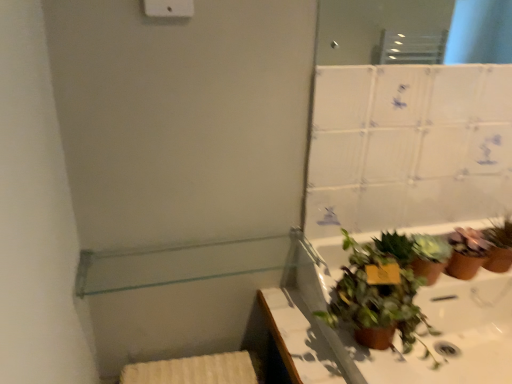
Question: Does clear glass shelf at upper left touch white plastic light switch at upper center?

Choices:
 (A) no
 (B) yes

Answer: (A)

Question: From the image's perspective, would you say clear glass shelf at upper left is shown under white plastic light switch at upper center?

Choices:
 (A) no
 (B) yes

Answer: (B)

Question: Does clear glass shelf at upper left have a greater height compared to white plastic light switch at upper center?

Choices:
 (A) no
 (B) yes

Answer: (A)

Question: Is clear glass shelf at upper left positioned in front of white plastic light switch at upper center?

Choices:
 (A) yes
 (B) no

Answer: (B)

Question: From a real-world perspective, does clear glass shelf at upper left stand above white plastic light switch at upper center?

Choices:
 (A) yes
 (B) no

Answer: (B)

Question: Is clear glass shelf at upper left bigger than white plastic light switch at upper center?

Choices:
 (A) no
 (B) yes

Answer: (B)

Question: Considering the relative sizes of brown matte plant pot at lower right and white plastic light switch at upper center in the image provided, is brown matte plant pot at lower right shorter than white plastic light switch at upper center?

Choices:
 (A) no
 (B) yes

Answer: (A)

Question: Is brown matte plant pot at lower right to the left of white plastic light switch at upper center from the viewer's perspective?

Choices:
 (A) yes
 (B) no

Answer: (B)

Question: Is brown matte plant pot at lower right in contact with white plastic light switch at upper center?

Choices:
 (A) yes
 (B) no

Answer: (B)

Question: Is brown matte plant pot at lower right turned away from white plastic light switch at upper center?

Choices:
 (A) no
 (B) yes

Answer: (A)

Question: Is the position of brown matte plant pot at lower right less distant than that of white plastic light switch at upper center?

Choices:
 (A) no
 (B) yes

Answer: (B)

Question: Is brown matte plant pot at lower right not near white plastic light switch at upper center?

Choices:
 (A) yes
 (B) no

Answer: (B)

Question: Is white plastic light switch at upper center facing away from brown matte pot at right, the second houseplant viewed from the left?

Choices:
 (A) yes
 (B) no

Answer: (B)